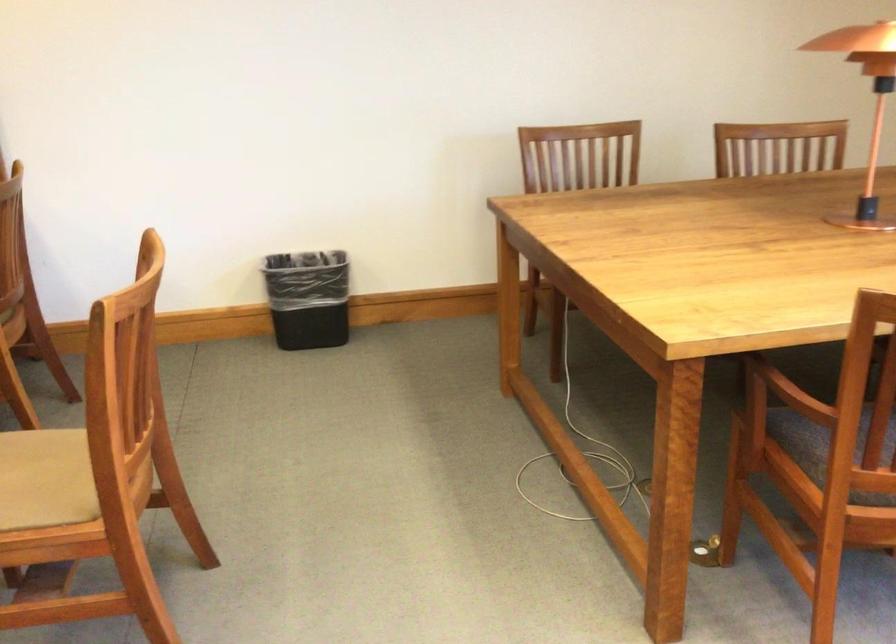
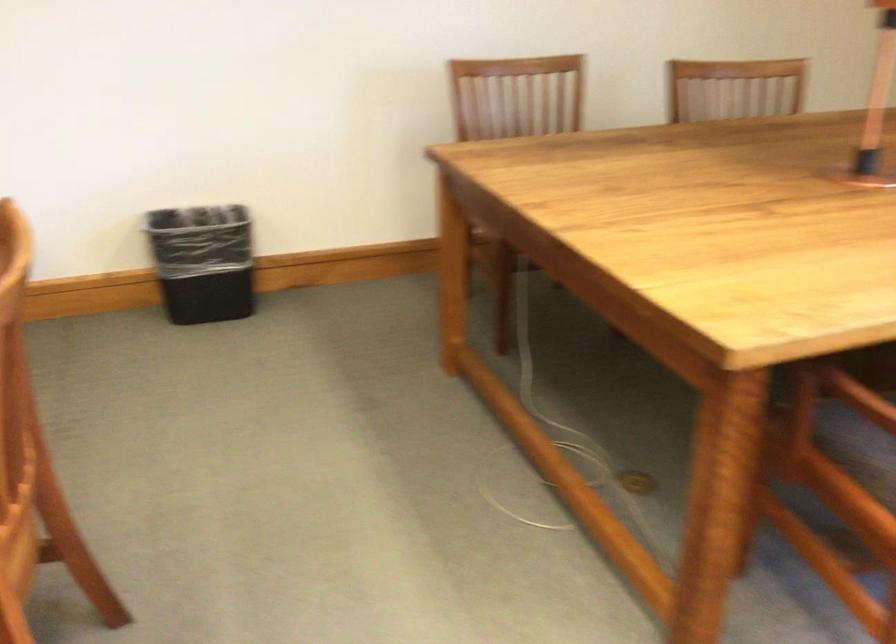
Where in the second image is the point corresponding to the point at 305,296 from the first image?

(202, 261)